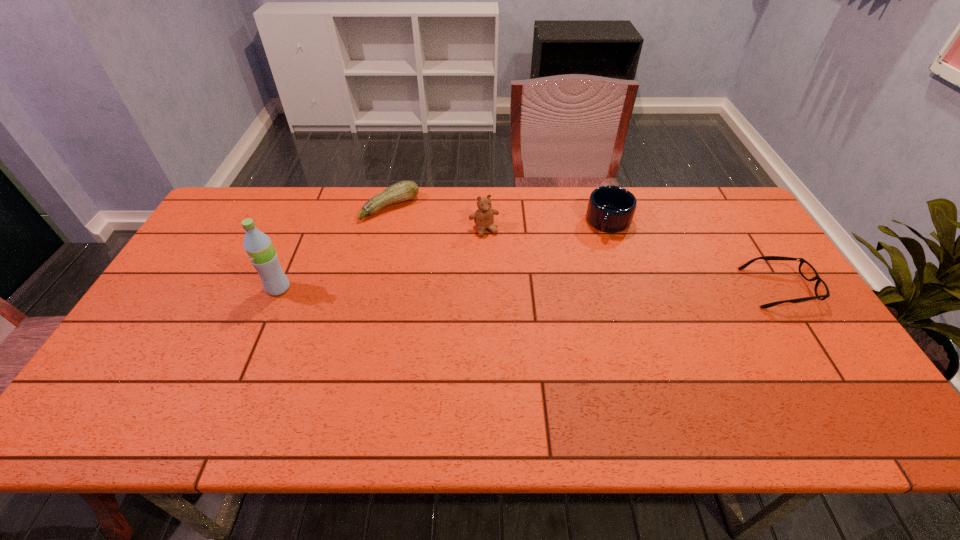
The height and width of the screenshot is (540, 960). In order to click on free space on the desktop that is between the water bottle and the spectacles and is positioned on the face of the second tallest object in this screenshot , I will do `click(512, 288)`.

You are a GUI agent. You are given a task and a screenshot of the screen. Output one action in this format:
    pyautogui.click(x=<x>, y=<y>)
    Task: Click on the vacant spot on the desktop that is between the tallest object and the shortest object and is positioned at the stem end of the fourth tallest object
    
    Given the screenshot: What is the action you would take?
    pyautogui.click(x=472, y=288)

Locate an element on the screen. This screenshot has width=960, height=540. vacant space on the desktop that is between the water bottle and the spectacles and is positioned with the handle on the side of the fourth object from left to right is located at coordinates (582, 288).